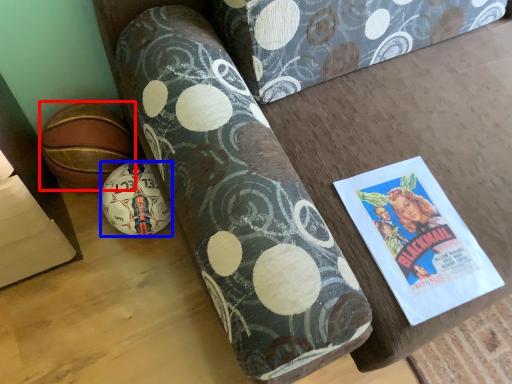
Question: Which object is closer to the camera taking this photo, ball (highlighted by a red box) or ball (highlighted by a blue box)?

Choices:
 (A) ball
 (B) ball

Answer: (B)